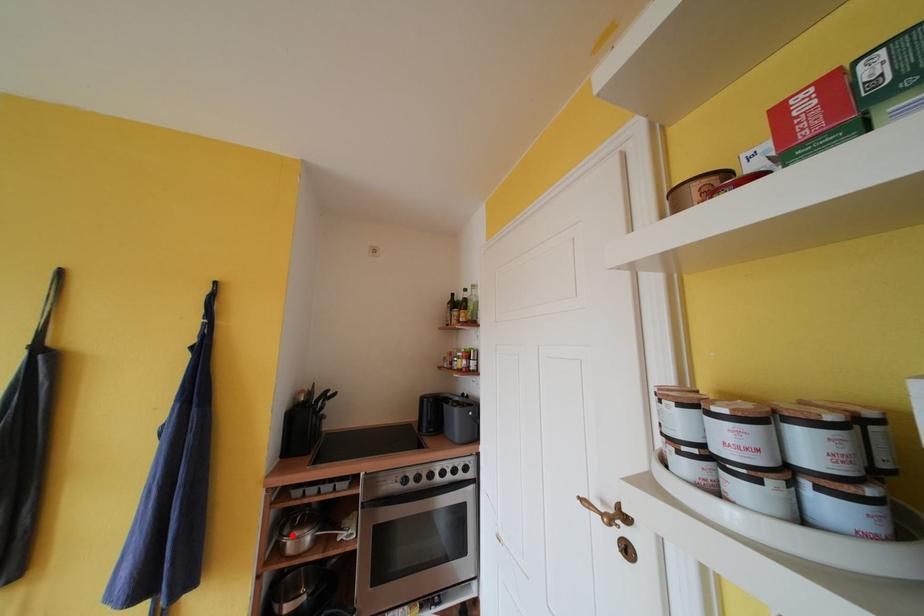
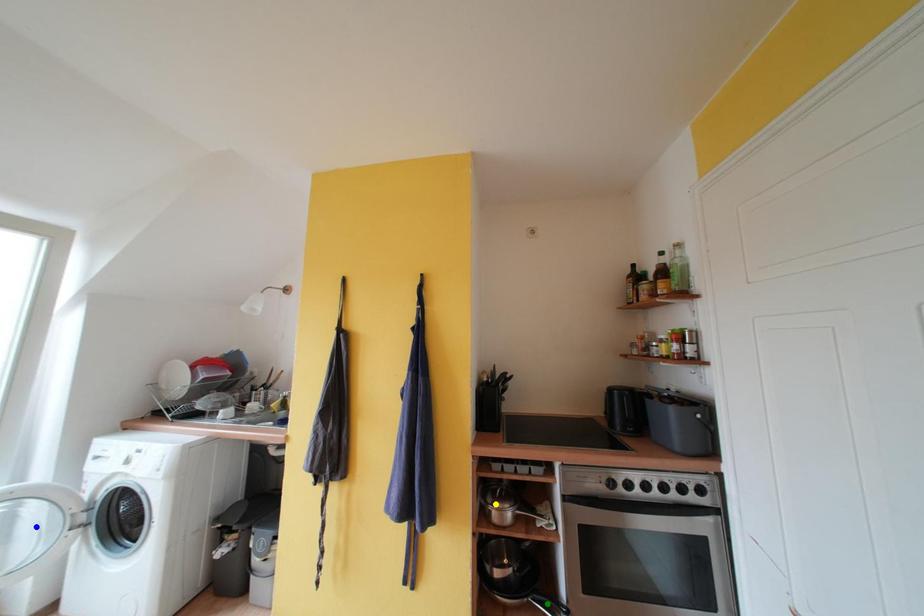
Question: I am providing you with two images of the same scene from different viewpoints. A red point is marked on the first image. You are given multiple points on the second image. Which point in image 2 represents the same 3d spot as the red point in image 1?

Choices:
 (A) blue point
 (B) green point
 (C) yellow point

Answer: (C)